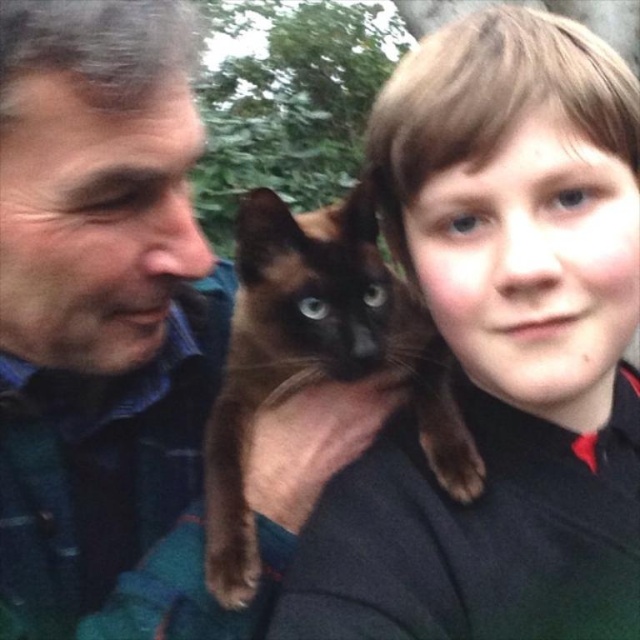
Can you confirm if brown fur cat at upper center is shorter than brown fur cat at center?

No, brown fur cat at upper center is not shorter than brown fur cat at center.

Does brown fur cat at upper center lie behind brown fur cat at center?

No, brown fur cat at upper center is closer to the viewer.

This screenshot has width=640, height=640. What are the coordinates of `brown fur cat at upper center` in the screenshot? It's located at (500, 349).

Image resolution: width=640 pixels, height=640 pixels. Find the location of `brown fur cat at upper center`. brown fur cat at upper center is located at coordinates (500, 349).